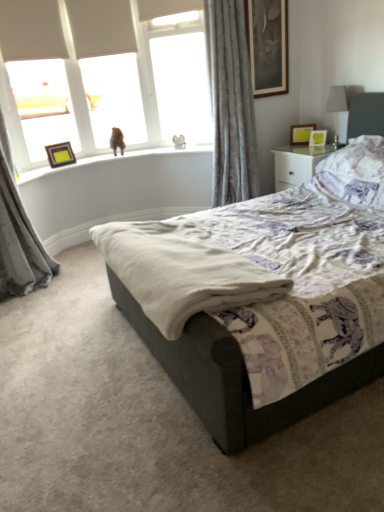
Question: Should I look upward or downward to see white glossy nightstand at upper right?

Choices:
 (A) up
 (B) down

Answer: (A)

Question: Considering the relative sizes of matte yellow picture frame at upper right, the third picture frame in the bottom-to-top sequence, and velvet gray curtain at left, which ranks as the 1th curtain in left-to-right order, in the image provided, is matte yellow picture frame at upper right, the third picture frame in the bottom-to-top sequence, taller than velvet gray curtain at left, which ranks as the 1th curtain in left-to-right order,?

Choices:
 (A) no
 (B) yes

Answer: (A)

Question: Is matte yellow picture frame at upper right, arranged as the third picture frame when viewed from the left, facing towards velvet gray curtain at left, the 2th curtain from the right?

Choices:
 (A) no
 (B) yes

Answer: (A)

Question: Does matte yellow picture frame at upper right, which ranks as the second picture frame in right-to-left order, have a larger size compared to velvet gray curtain at left, which ranks as the 1th curtain in left-to-right order?

Choices:
 (A) no
 (B) yes

Answer: (A)

Question: From the image's perspective, is matte yellow picture frame at upper right, which ranks as the second picture frame in right-to-left order, located above velvet gray curtain at left, the 2th curtain from the right?

Choices:
 (A) yes
 (B) no

Answer: (A)

Question: From the image's perspective, does matte yellow picture frame at upper right, which ranks as the second picture frame in right-to-left order, appear lower than velvet gray curtain at left, the 2th curtain from the right?

Choices:
 (A) yes
 (B) no

Answer: (B)

Question: Considering the relative sizes of matte yellow picture frame at upper right, which ranks as the second picture frame in right-to-left order, and velvet gray curtain at left, the 2th curtain from the right, in the image provided, is matte yellow picture frame at upper right, which ranks as the second picture frame in right-to-left order, smaller than velvet gray curtain at left, the 2th curtain from the right,?

Choices:
 (A) yes
 (B) no

Answer: (A)

Question: Is matte white frame at upper left facing away from matte yellow picture frame at upper right, the third picture frame viewed from the top?

Choices:
 (A) yes
 (B) no

Answer: (B)

Question: Considering the relative positions of matte white frame at upper left and matte yellow picture frame at upper right, marked as the first picture frame in a right-to-left arrangement, in the image provided, is matte white frame at upper left to the left of matte yellow picture frame at upper right, marked as the first picture frame in a right-to-left arrangement, from the viewer's perspective?

Choices:
 (A) no
 (B) yes

Answer: (B)

Question: Is matte white frame at upper left not close to matte yellow picture frame at upper right, marked as the first picture frame in a right-to-left arrangement?

Choices:
 (A) yes
 (B) no

Answer: (A)

Question: From a real-world perspective, is matte white frame at upper left on top of matte yellow picture frame at upper right, the third picture frame viewed from the top?

Choices:
 (A) no
 (B) yes

Answer: (B)

Question: Can you confirm if matte white frame at upper left is thinner than matte yellow picture frame at upper right, arranged as the second picture frame when ordered from the bottom?

Choices:
 (A) yes
 (B) no

Answer: (A)

Question: From a real-world perspective, is matte white frame at upper left positioned under matte yellow picture frame at upper right, marked as the first picture frame in a right-to-left arrangement, based on gravity?

Choices:
 (A) yes
 (B) no

Answer: (B)

Question: Is matte white frame at upper left positioned behind gray velvet curtain at upper right, which ranks as the second curtain in left-to-right order?

Choices:
 (A) yes
 (B) no

Answer: (A)